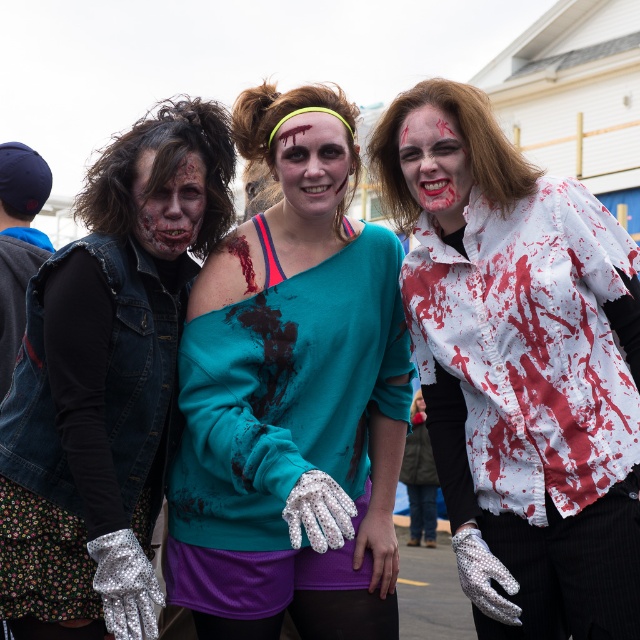
Can you confirm if silver metallic glove at left is bigger than matte flesh-colored makeup at center?

Correct, silver metallic glove at left is larger in size than matte flesh-colored makeup at center.

Can you confirm if silver metallic glove at left is positioned below matte flesh-colored makeup at center?

Yes, silver metallic glove at left is below matte flesh-colored makeup at center.

Describe the element at coordinates (86, 419) in the screenshot. I see `silver metallic glove at left` at that location.

I want to click on silver metallic glove at left, so click(86, 419).

Does white textured shirt at center have a greater width compared to matte flesh-colored makeup at center?

Correct, the width of white textured shirt at center exceeds that of matte flesh-colored makeup at center.

Is point (524, 419) farther from camera compared to point (156, 256)?

No, (524, 419) is in front of (156, 256).

At what (x,y) coordinates should I click in order to perform the action: click on white textured shirt at center. Please return your answer as a coordinate pair (x, y). The height and width of the screenshot is (640, 640). Looking at the image, I should click on (518, 365).

Which is behind, point (410, 109) or point (35, 365)?

Point (410, 109)

Between white textured shirt at center and silver metallic glove at left, which one has more height?

With more height is white textured shirt at center.

Which is behind, point (404, 304) or point (74, 388)?

The point (404, 304) is behind.

Locate an element on the screen. The image size is (640, 640). white textured shirt at center is located at coordinates (518, 365).